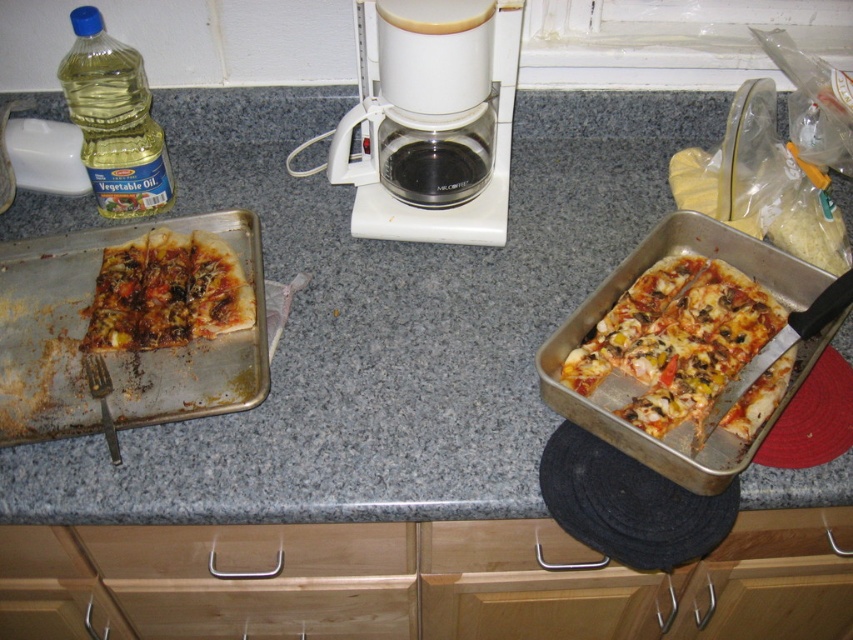
Question: Can you confirm if granite gray counter top at center is positioned to the left of wooden drawer at lower center?

Choices:
 (A) yes
 (B) no

Answer: (B)

Question: Can you confirm if silver/metallic pizza pan at left is thinner than wooden drawer at lower center?

Choices:
 (A) no
 (B) yes

Answer: (B)

Question: Can you confirm if white plastic coffee maker at center is wider than silver/metallic pizza pan at left?

Choices:
 (A) no
 (B) yes

Answer: (A)

Question: Which object is positioned closest to the translucent yellow vegetable oil at left?

Choices:
 (A) wooden drawer at lower center
 (B) golden brown crusty pizza at left

Answer: (B)

Question: Estimate the real-world distances between objects in this image. Which object is closer to the golden brown crusty pizza at left?

Choices:
 (A) cheesy pizza at right
 (B) silver/metallic pizza pan at left

Answer: (B)

Question: Which object is farther from the camera taking this photo?

Choices:
 (A) wooden drawer at lower center
 (B) translucent yellow vegetable oil at left
 (C) golden brown crusty pizza at left
 (D) silver/metallic pizza pan at left

Answer: (B)